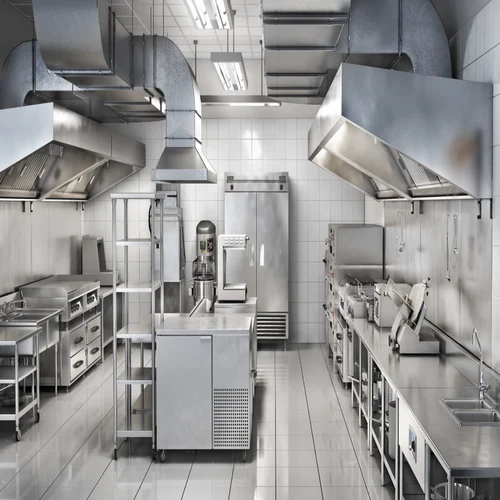
You are a GUI agent. You are given a task and a screenshot of the screen. Output one action in this format:
    pyautogui.click(x=<x>, y=<y>)
    Task: Click on the faucet
    
    Given the screenshot: What is the action you would take?
    (x=484, y=383)